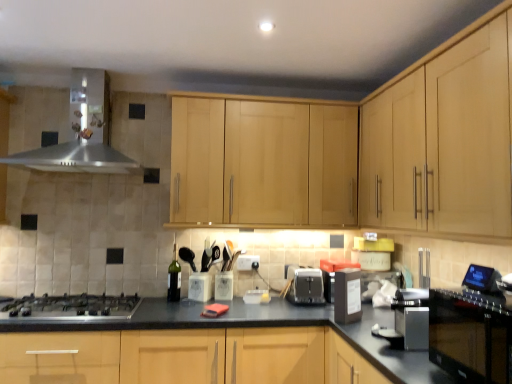
Question: Can you confirm if black plastic container at center-right, which appears as the 2th appliance when viewed from the back, is bigger than stainless steel range hood at upper left?

Choices:
 (A) no
 (B) yes

Answer: (A)

Question: From a real-world perspective, is black plastic container at center-right, the 2th appliance viewed from the left, located beneath stainless steel range hood at upper left?

Choices:
 (A) yes
 (B) no

Answer: (A)

Question: Is black plastic container at center-right, acting as the first appliance starting from the right, aimed at stainless steel range hood at upper left?

Choices:
 (A) yes
 (B) no

Answer: (B)

Question: From the image's perspective, does black plastic container at center-right, marked as the first appliance in a front-to-back arrangement, appear lower than stainless steel range hood at upper left?

Choices:
 (A) yes
 (B) no

Answer: (A)

Question: Would you say black plastic container at center-right, the 2th appliance viewed from the left, is outside stainless steel range hood at upper left?

Choices:
 (A) yes
 (B) no

Answer: (A)

Question: Which is correct: light wood cabinet at upper right, the first cabinetry in the right-to-left sequence, is inside black granite countertop at center, or outside of it?

Choices:
 (A) outside
 (B) inside

Answer: (A)

Question: In the image, is light wood cabinet at upper right, the first cabinetry in the right-to-left sequence, on the left side or the right side of black granite countertop at center?

Choices:
 (A) right
 (B) left

Answer: (A)

Question: From a real-world perspective, relative to black granite countertop at center, is light wood cabinet at upper right, the first cabinetry in the right-to-left sequence, vertically above or below?

Choices:
 (A) above
 (B) below

Answer: (A)

Question: Considering the positions of point (370, 114) and point (387, 322), is point (370, 114) closer or farther from the camera than point (387, 322)?

Choices:
 (A) farther
 (B) closer

Answer: (A)

Question: Based on their sizes in the image, would you say satin silver toaster at center, which is the 1th appliance in left-to-right order, is bigger or smaller than black granite countertop at center?

Choices:
 (A) big
 (B) small

Answer: (B)

Question: Considering the positions of point (308, 294) and point (382, 311), is point (308, 294) closer or farther from the camera than point (382, 311)?

Choices:
 (A) farther
 (B) closer

Answer: (A)

Question: In terms of height, does satin silver toaster at center, marked as the 2th appliance in a front-to-back arrangement, look taller or shorter compared to black granite countertop at center?

Choices:
 (A) tall
 (B) short

Answer: (B)

Question: Looking at their shapes, would you say satin silver toaster at center, the first appliance in the back-to-front sequence, is wider or thinner than black granite countertop at center?

Choices:
 (A) wide
 (B) thin

Answer: (B)

Question: Which is correct: light wood cabinet at upper right, the first cabinetry in the right-to-left sequence, is inside light wood cabinet at center, the first cabinetry from the left, or outside of it?

Choices:
 (A) outside
 (B) inside

Answer: (A)

Question: Looking at their shapes, would you say light wood cabinet at upper right, which ranks as the second cabinetry in left-to-right order, is wider or thinner than light wood cabinet at center, marked as the second cabinetry in a right-to-left arrangement?

Choices:
 (A) wide
 (B) thin

Answer: (B)